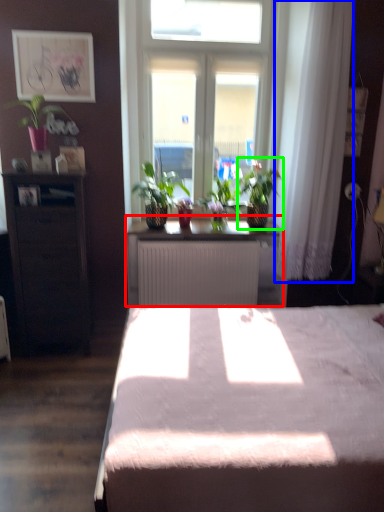
Question: Considering the real-world distances, which object is farthest from table (highlighted by a red box)? curtain (highlighted by a blue box) or houseplant (highlighted by a green box)?

Choices:
 (A) curtain
 (B) houseplant

Answer: (A)